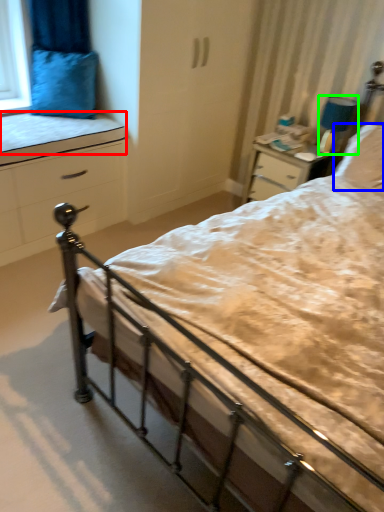
Question: Estimate the real-world distances between objects in this image. Which object is closer to mattress (highlighted by a red box), pillow (highlighted by a blue box) or lamp (highlighted by a green box)?

Choices:
 (A) pillow
 (B) lamp

Answer: (B)